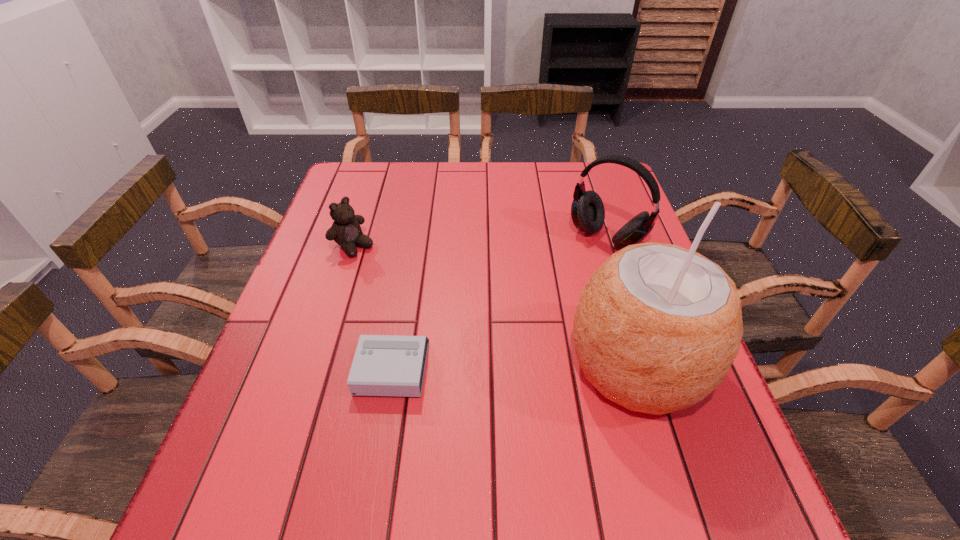
Identify the location of blank space at the near edge. This screenshot has height=540, width=960. (490, 417).

You are a GUI agent. You are given a task and a screenshot of the screen. Output one action in this format:
    pyautogui.click(x=<x>, y=<y>)
    Task: Click on the blank space at the left edge of the desktop
    This screenshot has height=540, width=960.
    Given the screenshot: What is the action you would take?
    pyautogui.click(x=291, y=310)

Where is `free location at the far left corner`? This screenshot has height=540, width=960. free location at the far left corner is located at coordinates (362, 193).

Identify the location of free location at the far right corner. Image resolution: width=960 pixels, height=540 pixels. (566, 166).

Find the location of a particular element. The height and width of the screenshot is (540, 960). free space that is in between the leftmost object and the second tallest object is located at coordinates (480, 241).

This screenshot has width=960, height=540. I want to click on unoccupied position between the shortest object and the tallest object, so click(x=515, y=366).

The width and height of the screenshot is (960, 540). Find the location of `unoccupied position between the teddy bear and the alarm clock`. unoccupied position between the teddy bear and the alarm clock is located at coordinates (372, 307).

This screenshot has height=540, width=960. Find the location of `free point between the teddy bear and the shortest object`. free point between the teddy bear and the shortest object is located at coordinates (372, 307).

Where is `free spot between the third tallest object and the alarm clock`? This screenshot has width=960, height=540. free spot between the third tallest object and the alarm clock is located at coordinates (372, 307).

Where is `vacant space that's between the leftmost object and the third object from right to left`? vacant space that's between the leftmost object and the third object from right to left is located at coordinates (372, 307).